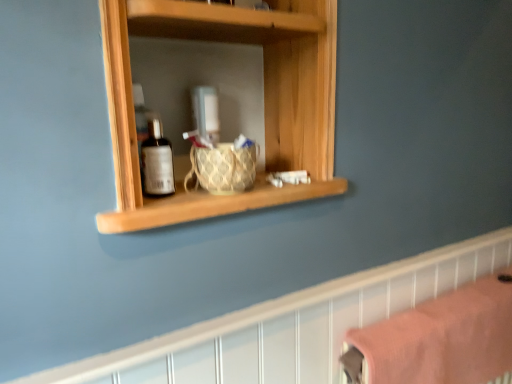
Locate an element on the screen. blank space situated above wooden shelf at upper center (from a real-world perspective) is located at coordinates (325, 284).